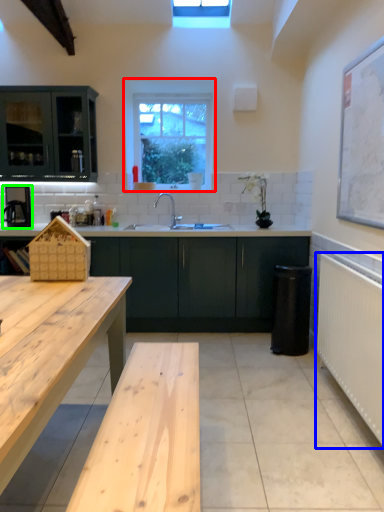
Question: Which object is the closest to the window (highlighted by a red box)? Choose among these: radiator (highlighted by a blue box) or appliance (highlighted by a green box).

Choices:
 (A) radiator
 (B) appliance

Answer: (B)